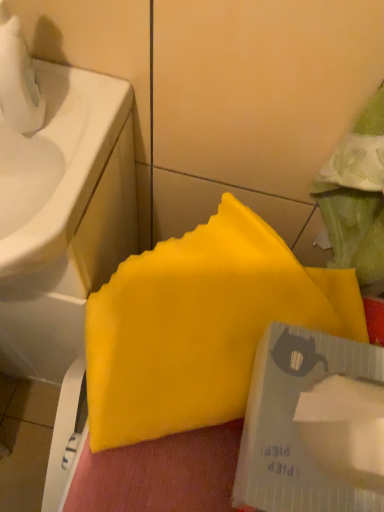
Question: Considering the relative sizes of white glossy sink at left and yellow matte paper at center in the image provided, is white glossy sink at left wider than yellow matte paper at center?

Choices:
 (A) no
 (B) yes

Answer: (B)

Question: Is white glossy sink at left surrounding yellow matte paper at center?

Choices:
 (A) no
 (B) yes

Answer: (A)

Question: Is white glossy sink at left oriented away from yellow matte paper at center?

Choices:
 (A) no
 (B) yes

Answer: (A)

Question: From a real-world perspective, does white glossy sink at left stand above yellow matte paper at center?

Choices:
 (A) no
 (B) yes

Answer: (B)

Question: Does white glossy sink at left have a lesser width compared to yellow matte paper at center?

Choices:
 (A) no
 (B) yes

Answer: (A)

Question: Considering the positions of white glossy sink at left and yellow matte paper at center in the image, is white glossy sink at left taller or shorter than yellow matte paper at center?

Choices:
 (A) short
 (B) tall

Answer: (A)

Question: Is white glossy sink at left wider or thinner than yellow matte paper at center?

Choices:
 (A) wide
 (B) thin

Answer: (A)

Question: Visually, is white glossy sink at left positioned to the left or to the right of yellow matte paper at center?

Choices:
 (A) right
 (B) left

Answer: (B)

Question: From a real-world perspective, is white glossy sink at left positioned above or below yellow matte paper at center?

Choices:
 (A) below
 (B) above

Answer: (B)

Question: Is point (92, 298) positioned closer to the camera than point (54, 199)?

Choices:
 (A) farther
 (B) closer

Answer: (A)

Question: Do you think yellow matte paper at center is within white glossy sink at left, or outside of it?

Choices:
 (A) inside
 (B) outside

Answer: (B)

Question: From their relative heights in the image, would you say yellow matte paper at center is taller or shorter than white glossy sink at left?

Choices:
 (A) tall
 (B) short

Answer: (A)

Question: Visually, is yellow matte paper at center positioned to the left or to the right of white glossy sink at left?

Choices:
 (A) right
 (B) left

Answer: (A)

Question: Is transparent plastic tape at lower right to the left or to the right of white glossy sink at left in the image?

Choices:
 (A) right
 (B) left

Answer: (A)

Question: Considering the positions of transparent plastic tape at lower right and white glossy sink at left in the image, is transparent plastic tape at lower right wider or thinner than white glossy sink at left?

Choices:
 (A) thin
 (B) wide

Answer: (A)